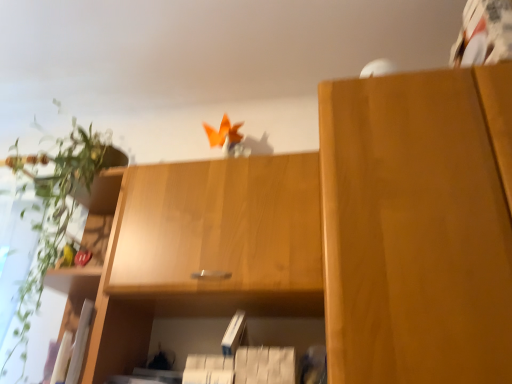
Question: Is matte wood cabinet at right, acting as the first cabinetry starting from the right, wider than white matte paperback book at center?

Choices:
 (A) yes
 (B) no

Answer: (A)

Question: Is matte wood cabinet at right, acting as the first cabinetry starting from the right, oriented away from white matte paperback book at center?

Choices:
 (A) no
 (B) yes

Answer: (A)

Question: From a real-world perspective, is matte wood cabinet at right, which ranks as the 2th cabinetry in left-to-right order, on top of white matte paperback book at center?

Choices:
 (A) no
 (B) yes

Answer: (B)

Question: Does matte wood cabinet at right, which ranks as the 2th cabinetry in left-to-right order, appear on the right side of white matte paperback book at center?

Choices:
 (A) no
 (B) yes

Answer: (B)

Question: Does matte wood cabinet at right, acting as the first cabinetry starting from the right, have a greater height compared to white matte paperback book at center?

Choices:
 (A) no
 (B) yes

Answer: (B)

Question: Is green leafy plant at left in front of or behind white matte paperback book at center in the image?

Choices:
 (A) front
 (B) behind

Answer: (A)

Question: From a real-world perspective, is green leafy plant at left above or below white matte paperback book at center?

Choices:
 (A) below
 (B) above

Answer: (B)

Question: Considering the positions of green leafy plant at left and white matte paperback book at center in the image, is green leafy plant at left taller or shorter than white matte paperback book at center?

Choices:
 (A) short
 (B) tall

Answer: (B)

Question: From the image's perspective, is green leafy plant at left located above or below white matte paperback book at center?

Choices:
 (A) above
 (B) below

Answer: (A)

Question: From a real-world perspective, is green leafy plant at left positioned above or below matte wood cabinet at right, acting as the first cabinetry starting from the right?

Choices:
 (A) below
 (B) above

Answer: (B)

Question: Is point (70, 183) closer or farther from the camera than point (336, 307)?

Choices:
 (A) closer
 (B) farther

Answer: (B)

Question: Looking at the image, does green leafy plant at left seem bigger or smaller compared to matte wood cabinet at right, which ranks as the 2th cabinetry in left-to-right order?

Choices:
 (A) small
 (B) big

Answer: (A)

Question: In terms of width, does green leafy plant at left look wider or thinner when compared to matte wood cabinet at right, which ranks as the 2th cabinetry in left-to-right order?

Choices:
 (A) wide
 (B) thin

Answer: (B)

Question: Is point (366, 238) closer or farther from the camera than point (239, 316)?

Choices:
 (A) closer
 (B) farther

Answer: (A)

Question: In terms of height, does matte wood cabinet at right, which ranks as the 2th cabinetry in left-to-right order, look taller or shorter compared to white matte paperback book at center?

Choices:
 (A) short
 (B) tall

Answer: (B)